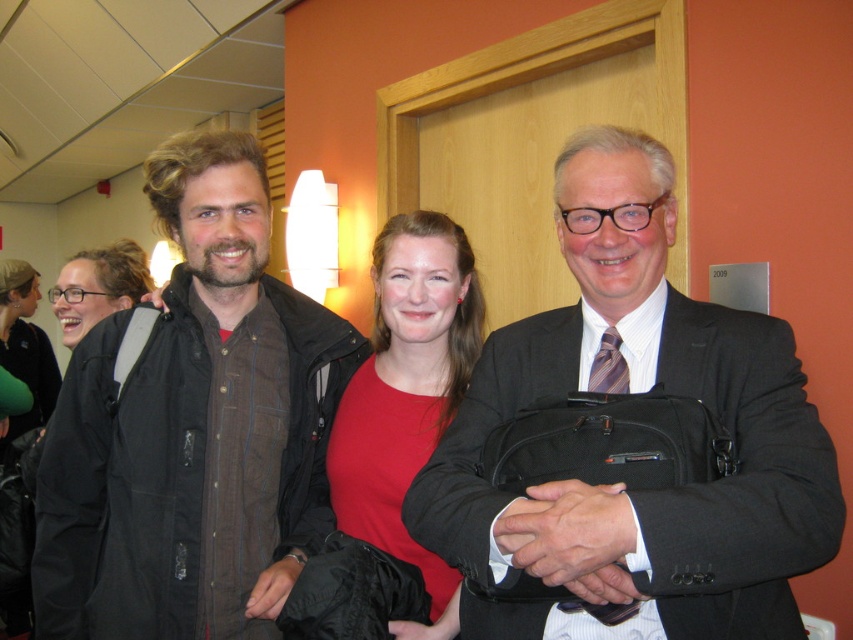
You are standing in the hallway and need to place a small plant exactly at the center of the matte black suit at center. Can you confirm the coordinates where the plant should be placed?

The matte black suit at center is located at point (624, 481), so the plant should be placed at those coordinates.

You are standing in a professional environment and see a point at coordinates (624, 481). What object is located there?

The object at point (624, 481) is a matte black suit at center.